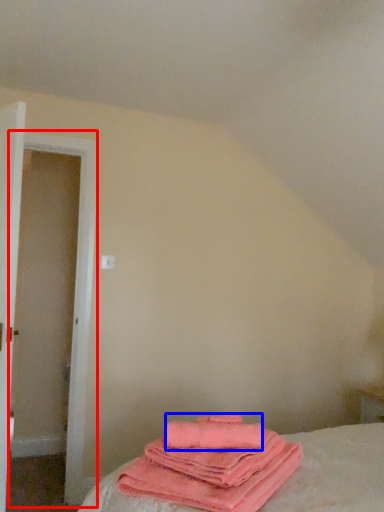
Question: Which point is further to the camera, door (highlighted by a red box) or beach towel (highlighted by a blue box)?

Choices:
 (A) door
 (B) beach towel

Answer: (A)